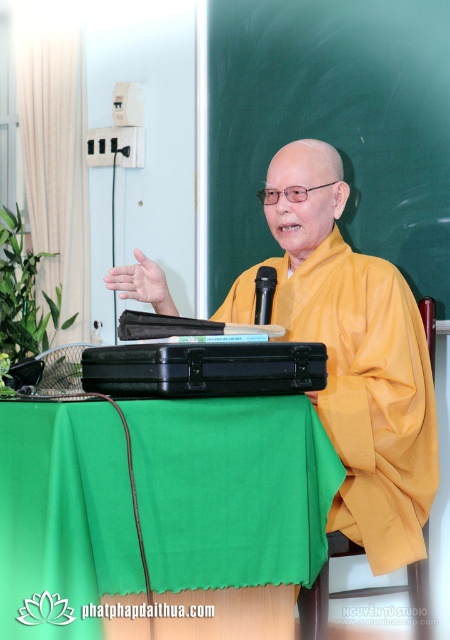
You are standing in the room and want to place a new object exactly where the green fabric table at center is located. What are the coordinates of that location?

The coordinates of the location where the green fabric table at center is situated are at point (x=232, y=490).

You are organizing a small event and need to ensure that the yellow matte robe at center and the black plastic microphone at center are both visible to the audience. Based on their sizes, which object might require more space in the setup?

The yellow matte robe at center is larger in size than the black plastic microphone at center, so it would require more space in the setup to ensure visibility.

You are organizing a small event and need to place a 30 cm wide laptop on the table. Given the dimensions of the green fabric table at center and the black plastic microphone at center, can the laptop fit on the table without moving the microphone?

The green fabric table at center is wider than the black plastic microphone at center. Since the microphone is placed near the edge, there should be enough space to place the 30 cm wide laptop on the table without moving the microphone.